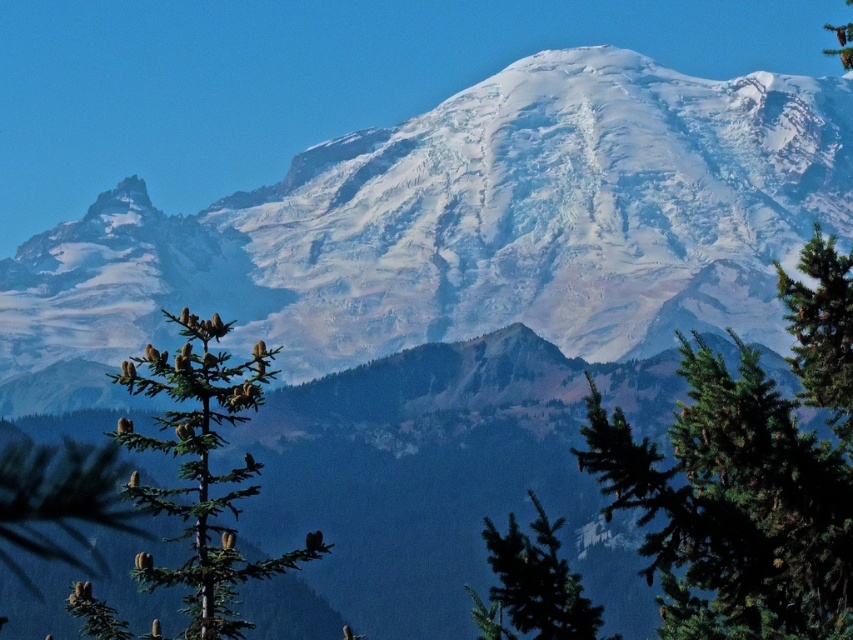
Which is in front, point (151, 570) or point (848, 58)?

Point (151, 570) is in front.

Does point (183, 316) lie behind point (833, 51)?

No, it is in front of (833, 51).

What are the coordinates of `green needle-like tree at center-left` in the screenshot? It's located at (202, 470).

Can you confirm if green needle-like at center is positioned to the right of green matte tree at lower center?

Indeed, green needle-like at center is positioned on the right side of green matte tree at lower center.

Does green needle-like at center have a larger size compared to green matte tree at lower center?

Yes.

Which is behind, point (646, 556) or point (469, 593)?

The point (646, 556) is more distant.

Identify the location of green needle-like at center. (733, 506).

Looking at this image, is snowy rock mountain at center taller than green matte tree at lower center?

Yes.

In the scene shown: Does snowy rock mountain at center have a lesser height compared to green matte tree at lower center?

No.

Who is more distant from viewer, (68, 358) or (566, 621)?

Point (68, 358)

Find the location of `snowy rock mountain at center`. snowy rock mountain at center is located at coordinates (461, 228).